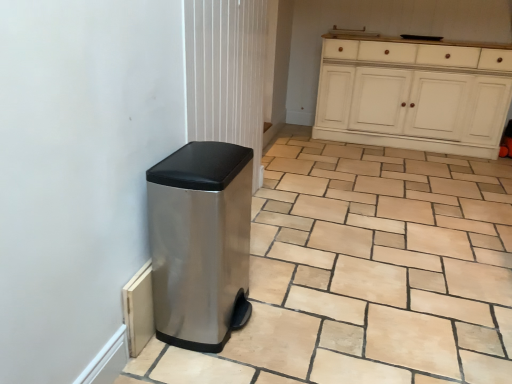
Locate an element on the screen. vacant area that is in front of polished stainless steel trash can at lower left is located at coordinates pos(204,366).